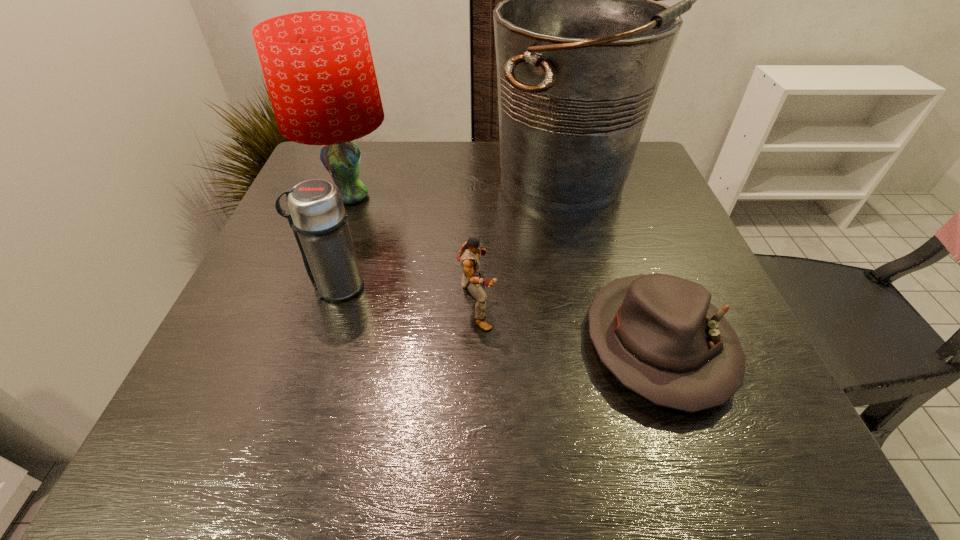
Where is `vacant area between the hat and the thermos bottle`? This screenshot has height=540, width=960. vacant area between the hat and the thermos bottle is located at coordinates (497, 315).

Locate an element on the screen. free space between the puncher and the shortest object is located at coordinates (567, 325).

In order to click on vacant region between the thermos bottle and the bucket in this screenshot , I will do `click(453, 234)`.

You are a GUI agent. You are given a task and a screenshot of the screen. Output one action in this format:
    pyautogui.click(x=<x>, y=<y>)
    Task: Click on the free point between the puncher and the third tallest object
    The width and height of the screenshot is (960, 540).
    Given the screenshot: What is the action you would take?
    pyautogui.click(x=406, y=296)

The image size is (960, 540). I want to click on vacant area that lies between the lampshade and the hat, so click(504, 270).

Where is `free space between the bucket and the thermos bottle`? This screenshot has width=960, height=540. free space between the bucket and the thermos bottle is located at coordinates (453, 234).

Locate an element on the screen. The image size is (960, 540). object identified as the third closest to the bucket is located at coordinates (318, 67).

Point out which object is positioned as the nearest to the lampshade. Please provide its 2D coordinates. Your answer should be formatted as a tuple, i.e. [(x, y)], where the tuple contains the x and y coordinates of a point satisfying the conditions above.

[(316, 214)]

The height and width of the screenshot is (540, 960). I want to click on free space in the image that satisfies the following two spatial constraints: 1. on the front side of the bucket; 2. with a handle on the side of the thermos bottle, so click(x=597, y=287).